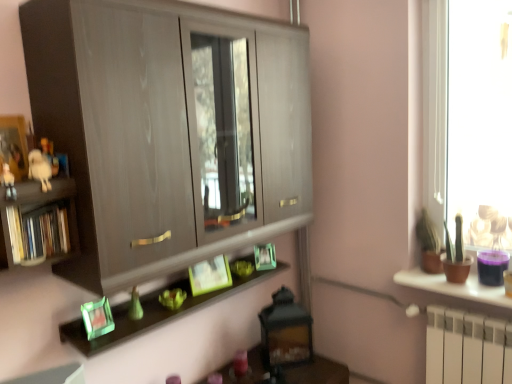
Question: Are green matte plant at right, the first houseplant positioned from the back, and white matte figurine at left located far from each other?

Choices:
 (A) no
 (B) yes

Answer: (B)

Question: Does green matte plant at right, the first houseplant positioned from the back, appear on the right side of white matte figurine at left?

Choices:
 (A) yes
 (B) no

Answer: (A)

Question: Does green matte plant at right, the 2th houseplant in the front-to-back sequence, touch white matte figurine at left?

Choices:
 (A) yes
 (B) no

Answer: (B)

Question: Is green matte plant at right, the 2th houseplant in the front-to-back sequence, closer to camera compared to white matte figurine at left?

Choices:
 (A) yes
 (B) no

Answer: (B)

Question: From the image's perspective, is green matte plant at right, the first houseplant positioned from the back, above white matte figurine at left?

Choices:
 (A) yes
 (B) no

Answer: (B)

Question: Is green matte plant at right, the first houseplant positioned from the back, wider than white matte figurine at left?

Choices:
 (A) no
 (B) yes

Answer: (B)

Question: Does green matte picture frame at center, the 2th picture frame in the right-to-left sequence, appear on the left side of white plush toy at left?

Choices:
 (A) yes
 (B) no

Answer: (B)

Question: From a real-world perspective, is green matte picture frame at center, the 2th picture frame in the right-to-left sequence, located higher than white plush toy at left?

Choices:
 (A) no
 (B) yes

Answer: (A)

Question: From the image's perspective, is green matte picture frame at center, which appears as the 2th picture frame when viewed from the back, over white plush toy at left?

Choices:
 (A) yes
 (B) no

Answer: (B)

Question: Is green matte picture frame at center, the 2th picture frame in the right-to-left sequence, directly adjacent to white plush toy at left?

Choices:
 (A) yes
 (B) no

Answer: (B)

Question: From a real-world perspective, is green matte picture frame at center, the 2th picture frame in the right-to-left sequence, located beneath white plush toy at left?

Choices:
 (A) yes
 (B) no

Answer: (A)

Question: Does green matte picture frame at center, which appears as the 2th picture frame when viewed from the back, have a greater width compared to white plush toy at left?

Choices:
 (A) no
 (B) yes

Answer: (B)

Question: Is the position of green matte picture frame at center, the 3th picture frame positioned from the front, less distant than that of green matte cactus at right, the first houseplant viewed from the front?

Choices:
 (A) no
 (B) yes

Answer: (A)